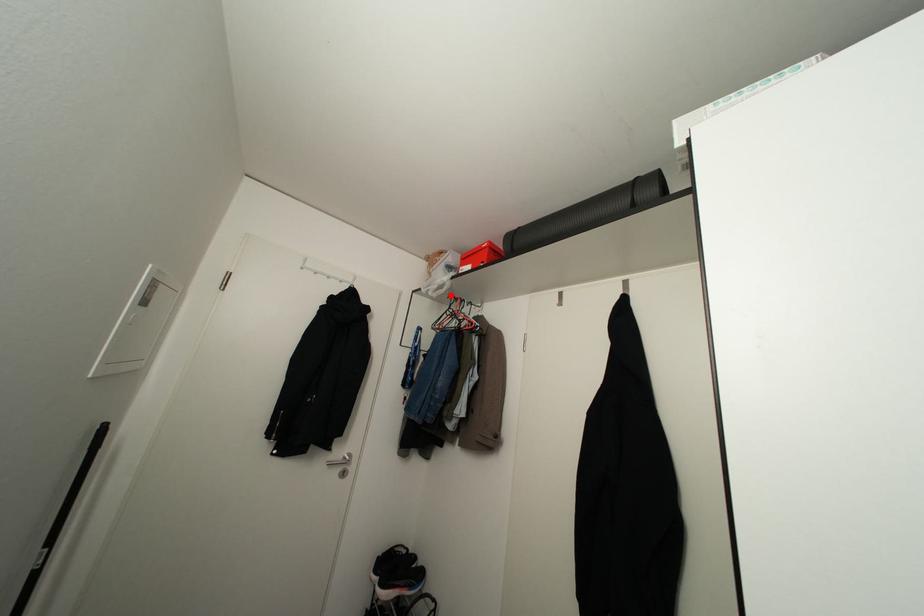
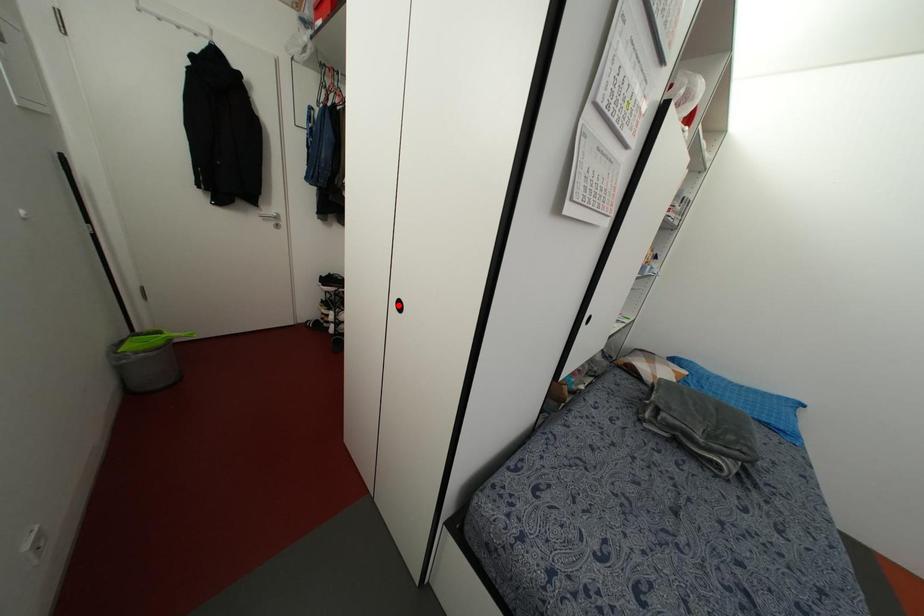
I am providing you with two images of the same scene from different viewpoints. A red point is marked on the first image and another point is marked on the second image. Do the highlighted points in image1 and image2 indicate the same real-world spot?

No